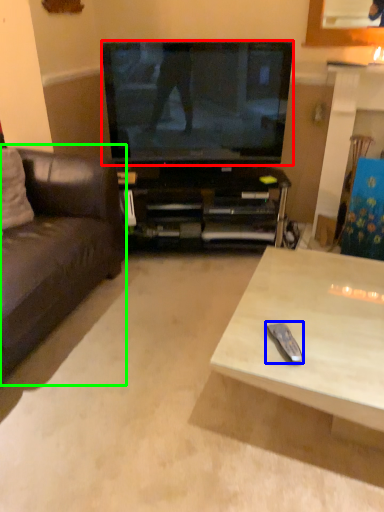
Question: Which is nearer to the television (highlighted by a red box)? remote control (highlighted by a blue box) or studio couch (highlighted by a green box).

Choices:
 (A) remote control
 (B) studio couch

Answer: (B)